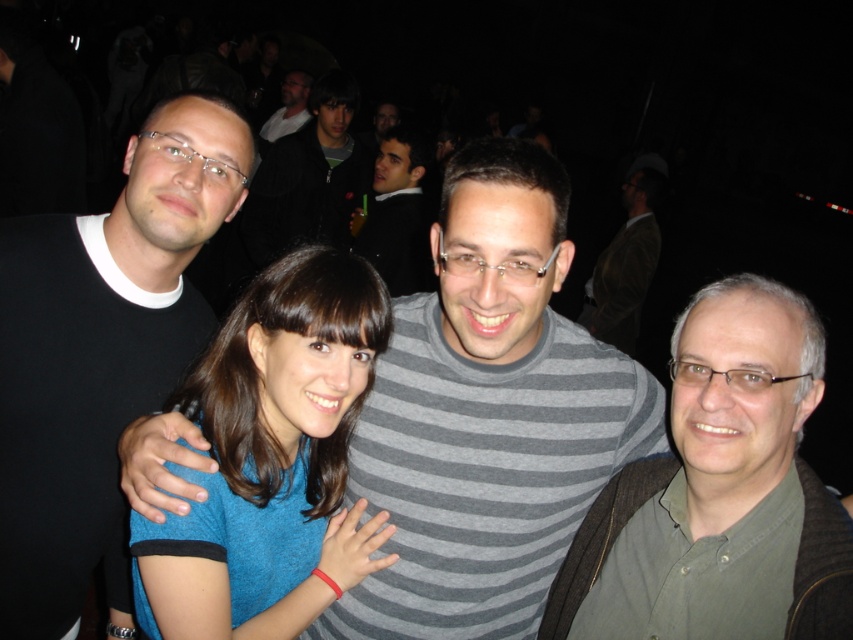
Question: Is black matte t-shirt at left above blue fabric at center?

Choices:
 (A) yes
 (B) no

Answer: (A)

Question: Which is farther from the black matte t-shirt at left?

Choices:
 (A) matte black shirt at upper center
 (B) dark gray striped sweater at center
 (C) green matte shirt at right

Answer: (A)

Question: Which point is closer to the camera?

Choices:
 (A) (138, 561)
 (B) (253, 177)
 (C) (728, 496)

Answer: (A)

Question: Which object is farther from the camera taking this photo?

Choices:
 (A) dark gray striped sweater at center
 (B) black matte shirt at left

Answer: (A)

Question: Considering the relative positions of green matte shirt at right and dark gray sweater at upper center in the image provided, where is green matte shirt at right located with respect to dark gray sweater at upper center?

Choices:
 (A) below
 (B) above

Answer: (A)

Question: Where is green matte shirt at right located in relation to brown textured jacket at upper right in the image?

Choices:
 (A) below
 (B) above

Answer: (A)